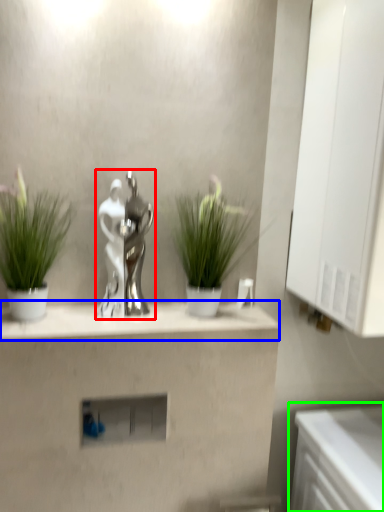
Question: Which object is positioned closest to tap (highlighted by a red box)? Select from mantle (highlighted by a blue box) and counter (highlighted by a green box).

Choices:
 (A) mantle
 (B) counter

Answer: (A)